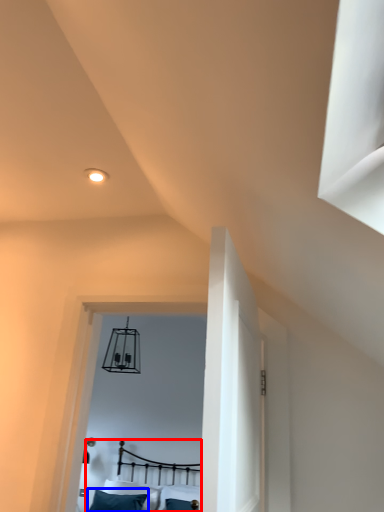
Question: Which point is closer to the camera, bed (highlighted by a red box) or pillow (highlighted by a blue box)?

Choices:
 (A) bed
 (B) pillow

Answer: (A)